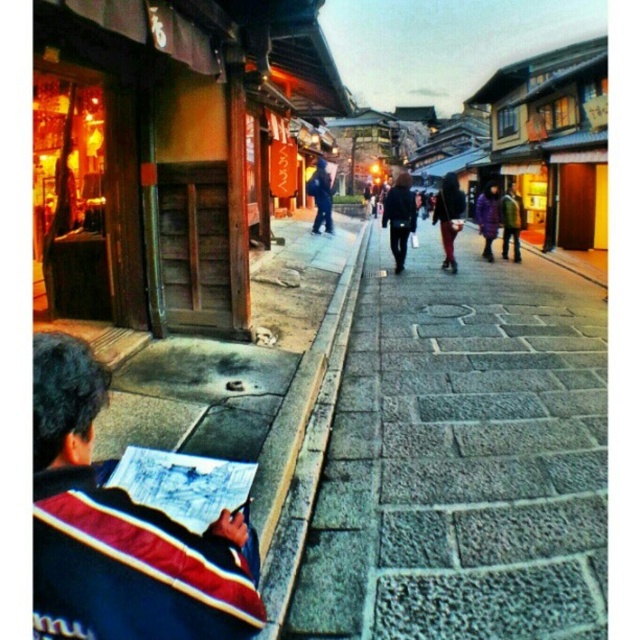
You are a traveler standing in front of the traditional wooden shop and notice both the wooden signboard at upper left and the purple fabric jacket at center. Which object is larger in size?

The purple fabric jacket at center is larger than the wooden signboard at upper left.

You are standing at the entrance of the traditional wooden shop on the left side of the image. Looking towards the center, you see a point marked at coordinates (x=461, y=460). What is located at that point?

The point at coordinates (x=461, y=460) indicates gray stone pavement at center.